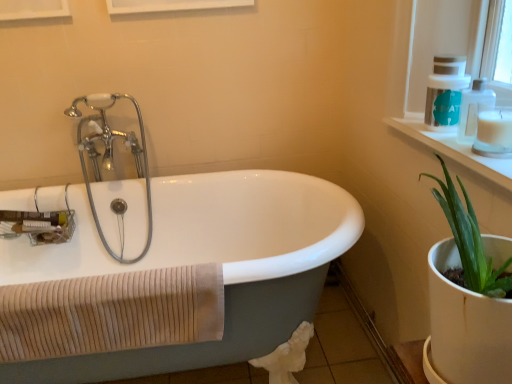
Question: In terms of width, does white glossy bathtub at center look wider or thinner when compared to clear plastic soap dispenser at upper right, placed as the 2th soap dispenser when sorted from back to front?

Choices:
 (A) thin
 (B) wide

Answer: (B)

Question: Is white glossy bathtub at center bigger or smaller than clear plastic soap dispenser at upper right, placed as the 2th soap dispenser when sorted from back to front?

Choices:
 (A) small
 (B) big

Answer: (B)

Question: Which object is the farthest from the white plastic soap dispenser at upper right, acting as the 2th soap dispenser starting from the front?

Choices:
 (A) white matte candle at upper right
 (B) chrome/metallic faucet at upper left
 (C) clear plastic soap dispenser at upper right, placed as the 2th soap dispenser when sorted from back to front
 (D) white glossy bathtub at center
 (E) white plastic window frame at upper right

Answer: (B)

Question: Estimate the real-world distances between objects in this image. Which object is farther from the clear plastic soap dispenser at upper right, acting as the 1th soap dispenser starting from the front?

Choices:
 (A) white glossy shelf at upper right
 (B) chrome/metallic faucet at upper left
 (C) beige ribbed towel at lower left
 (D) white plastic soap dispenser at upper right, acting as the 2th soap dispenser starting from the front
 (E) white matte candle at upper right

Answer: (B)